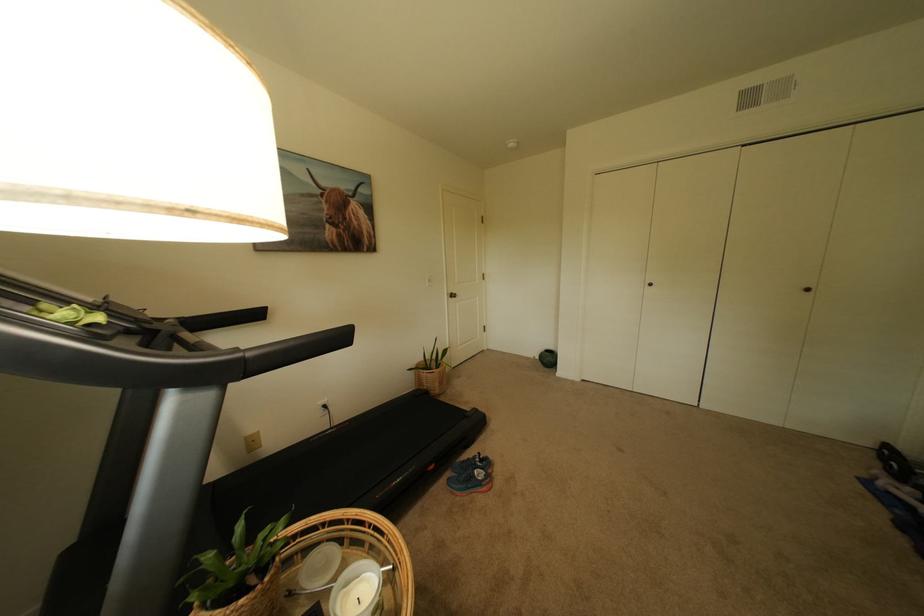
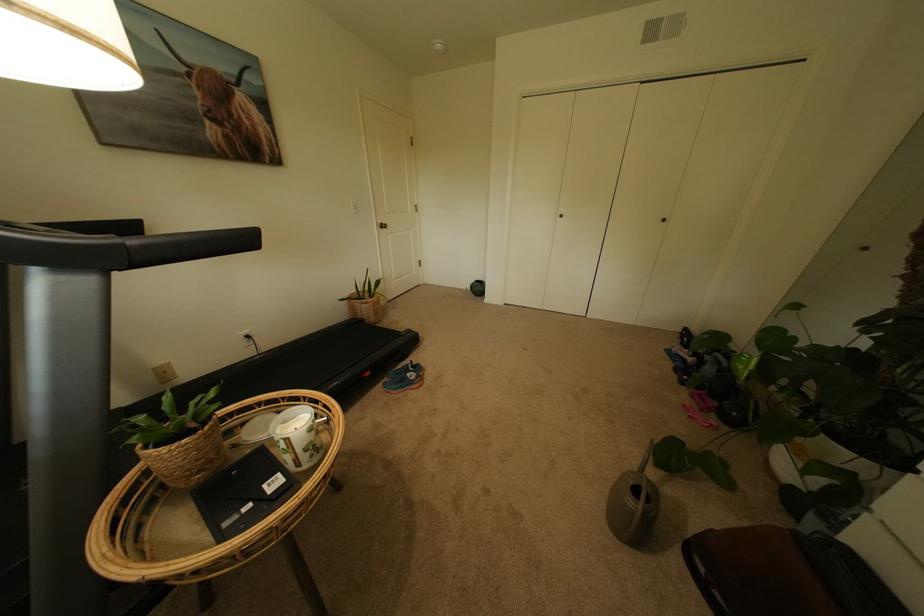
Find the pixel in the second image that matches point (464, 299) in the first image.

(394, 229)